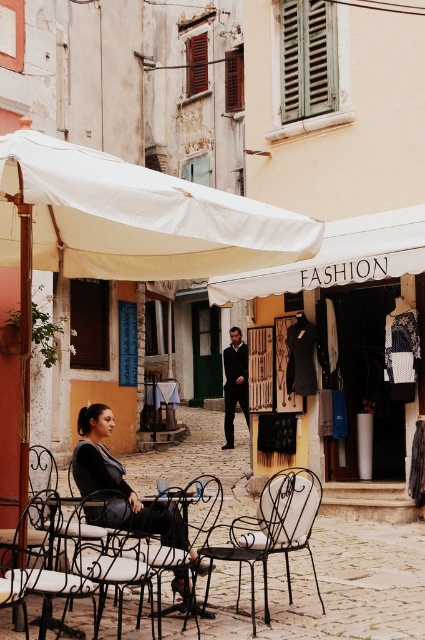
Question: Does black wrought iron chair at center have a lesser width compared to black wrought iron chair at lower left?

Choices:
 (A) yes
 (B) no

Answer: (B)

Question: Among these points, which one is nearest to the camera?

Choices:
 (A) (390, 250)
 (B) (240, 396)
 (C) (169, 524)

Answer: (C)

Question: Can you confirm if matte black dress at center is positioned to the right of white wrought iron chair at center?

Choices:
 (A) no
 (B) yes

Answer: (A)

Question: Estimate the real-world distances between objects in this image. Which object is farther from the black wrought iron chair at lower left?

Choices:
 (A) textured fabric clothing at center
 (B) matte black dress at center

Answer: (A)

Question: Can you confirm if black wrought iron chair at lower left is wider than wooden table at center?

Choices:
 (A) yes
 (B) no

Answer: (B)

Question: Among these objects, which one is nearest to the camera?

Choices:
 (A) white wrought iron chair at center
 (B) textured fabric clothing at center
 (C) wooden table at center

Answer: (A)